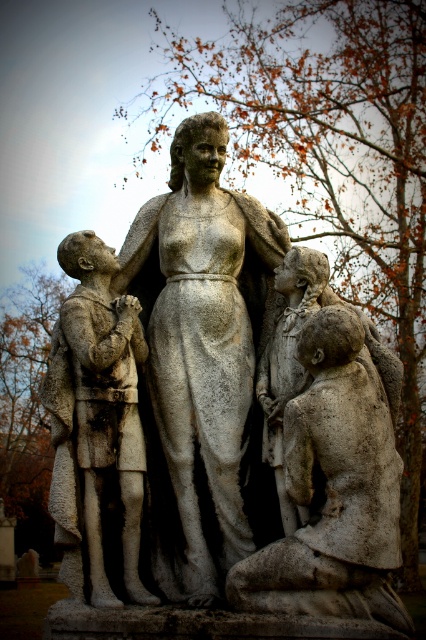
Who is higher up, white stone statue at center or stone textured girl at center?

white stone statue at center

Does white stone statue at center have a lesser width compared to stone textured girl at center?

In fact, white stone statue at center might be wider than stone textured girl at center.

Find the location of a particular element. The image size is (426, 640). white stone statue at center is located at coordinates (232, 426).

Can you confirm if stone statue of boy at left is positioned to the right of stone textured girl at center?

Incorrect, stone statue of boy at left is not on the right side of stone textured girl at center.

At what (x,y) coordinates should I click in order to perform the action: click on stone statue of boy at left. Please return your answer as a coordinate pair (x, y). The height and width of the screenshot is (640, 426). Looking at the image, I should click on (95, 420).

Which is in front, point (184, 216) or point (140, 449)?

Point (140, 449)

Is stone statue at center smaller than stone statue of boy at left?

No, stone statue at center is not smaller than stone statue of boy at left.

Which is in front, point (161, 305) or point (92, 602)?

Positioned in front is point (92, 602).

This screenshot has width=426, height=640. Find the location of `stone statue at center`. stone statue at center is located at coordinates point(201,358).